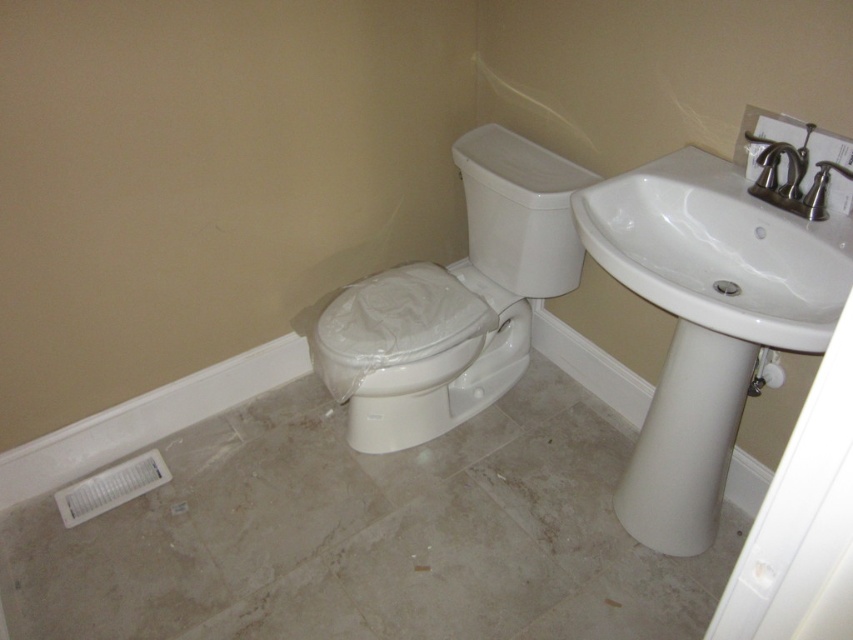
Question: Among these points, which one is nearest to the camera?

Choices:
 (A) (419, 301)
 (B) (679, 173)

Answer: (B)

Question: Which is nearer to the white glossy sink at upper right?

Choices:
 (A) matte black faucet at upper right
 (B) white glossy toilet bowl at center
 (C) white glossy toilet at center

Answer: (A)

Question: Is white glossy toilet bowl at center positioned in front of matte black faucet at upper right?

Choices:
 (A) no
 (B) yes

Answer: (A)

Question: Does white glossy toilet at center have a greater width compared to matte black faucet at upper right?

Choices:
 (A) no
 (B) yes

Answer: (B)

Question: Which point is closer to the camera?

Choices:
 (A) matte black faucet at upper right
 (B) white glossy toilet bowl at center
 (C) white glossy sink at upper right
 (D) white glossy toilet at center

Answer: (C)

Question: Is white glossy toilet at center bigger than white glossy sink at upper right?

Choices:
 (A) no
 (B) yes

Answer: (B)